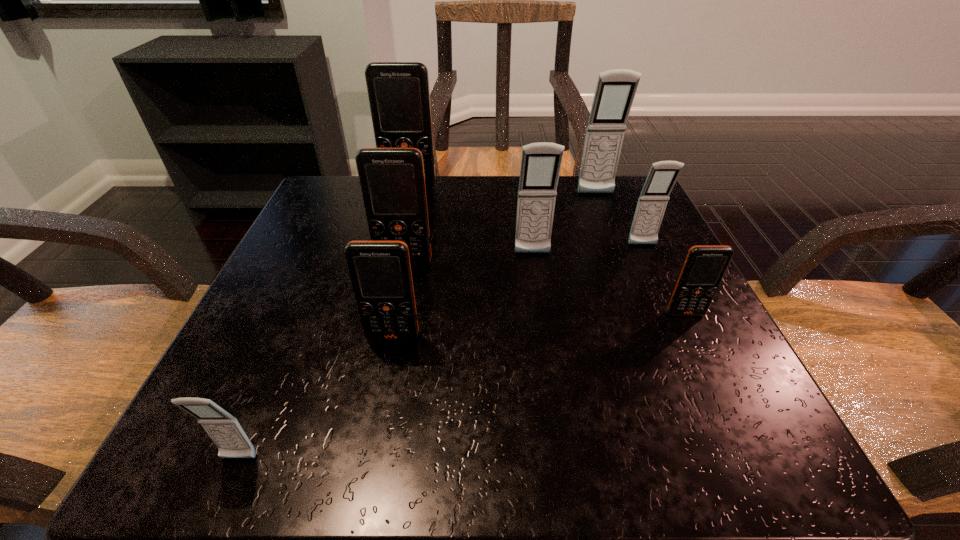
Locate an element on the screen. The image size is (960, 540). the farthest orange cellular telephone is located at coordinates (399, 97).

Locate an element on the screen. the farthest gray cellular telephone is located at coordinates (615, 91).

Identify the location of the fifth nearest object. (541, 162).

The width and height of the screenshot is (960, 540). What are the coordinates of `the second biggest gray cellular telephone` in the screenshot? It's located at (541, 162).

The width and height of the screenshot is (960, 540). What are the coordinates of `the fifth farthest cellular telephone` in the screenshot? It's located at (392, 181).

The width and height of the screenshot is (960, 540). I want to click on the third smallest orange cellular telephone, so click(x=392, y=181).

In order to click on the sixth nearest object in this screenshot , I will do `click(662, 176)`.

This screenshot has width=960, height=540. Identify the location of the third nearest gray cellular telephone. (662, 176).

Locate an element on the screen. The height and width of the screenshot is (540, 960). the third biggest orange cellular telephone is located at coordinates (380, 271).

Find the location of a particular element. The image size is (960, 540). the nearest orange cellular telephone is located at coordinates (380, 271).